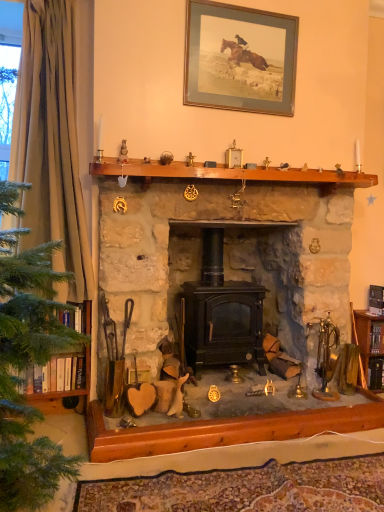
Question: Can you confirm if brown wooden mantle at upper center is smaller than matte black wood-burning stove at center?

Choices:
 (A) no
 (B) yes

Answer: (B)

Question: Would you say brown wooden mantle at upper center is outside matte black wood-burning stove at center?

Choices:
 (A) no
 (B) yes

Answer: (A)

Question: Can you confirm if brown wooden mantle at upper center is wider than matte black wood-burning stove at center?

Choices:
 (A) no
 (B) yes

Answer: (A)

Question: From the image's perspective, does brown wooden mantle at upper center appear higher than matte black wood-burning stove at center?

Choices:
 (A) no
 (B) yes

Answer: (B)

Question: Can you confirm if brown wooden mantle at upper center is shorter than matte black wood-burning stove at center?

Choices:
 (A) no
 (B) yes

Answer: (B)

Question: Is brown wooden mantle at upper center positioned far away from matte black wood-burning stove at center?

Choices:
 (A) no
 (B) yes

Answer: (A)

Question: From the image's perspective, is matte black wood-burning stove at center under green fabric curtain at left?

Choices:
 (A) yes
 (B) no

Answer: (A)

Question: Is matte black wood-burning stove at center located outside green fabric curtain at left?

Choices:
 (A) yes
 (B) no

Answer: (A)

Question: Does matte black wood-burning stove at center have a greater height compared to green fabric curtain at left?

Choices:
 (A) no
 (B) yes

Answer: (A)

Question: Is there a large distance between matte black wood-burning stove at center and green fabric curtain at left?

Choices:
 (A) yes
 (B) no

Answer: (B)

Question: Is matte black wood-burning stove at center next to green fabric curtain at left?

Choices:
 (A) yes
 (B) no

Answer: (B)

Question: From the image's perspective, is matte black wood-burning stove at center above green fabric curtain at left?

Choices:
 (A) no
 (B) yes

Answer: (A)

Question: Would you say green fabric curtain at left is a long distance from brown wooden mantle at upper center?

Choices:
 (A) no
 (B) yes

Answer: (A)